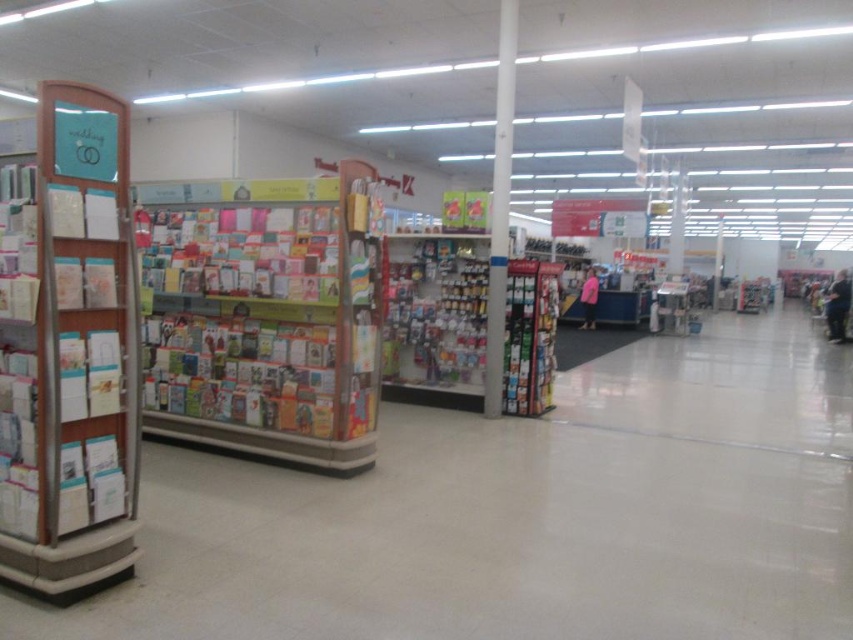
Measure the distance between wooden bookshelf at left and pink fabric jacket at center.

The distance of wooden bookshelf at left from pink fabric jacket at center is 17.07 meters.

Locate an element on the screen. wooden bookshelf at left is located at coordinates click(73, 358).

Image resolution: width=853 pixels, height=640 pixels. Find the location of `wooden bookshelf at left`. wooden bookshelf at left is located at coordinates (73, 358).

Who is lower down, matte cardboard bookshelf at left or multicolored paper cards at center?

matte cardboard bookshelf at left is lower down.

Is the position of matte cardboard bookshelf at left less distant than that of multicolored paper cards at center?

Yes, matte cardboard bookshelf at left is closer to the viewer.

The image size is (853, 640). Find the location of `matte cardboard bookshelf at left`. matte cardboard bookshelf at left is located at coordinates click(x=265, y=316).

Where is `matte cardboard bookshelf at left`? The height and width of the screenshot is (640, 853). matte cardboard bookshelf at left is located at coordinates (265, 316).

Is the position of wooden bookshelf at left more distant than that of dark blue jeans at lower right?

That is False.

Who is more forward, [96,330] or [834,305]?

Point [96,330]

What are the coordinates of `wooden bookshelf at left` in the screenshot? It's located at (73, 358).